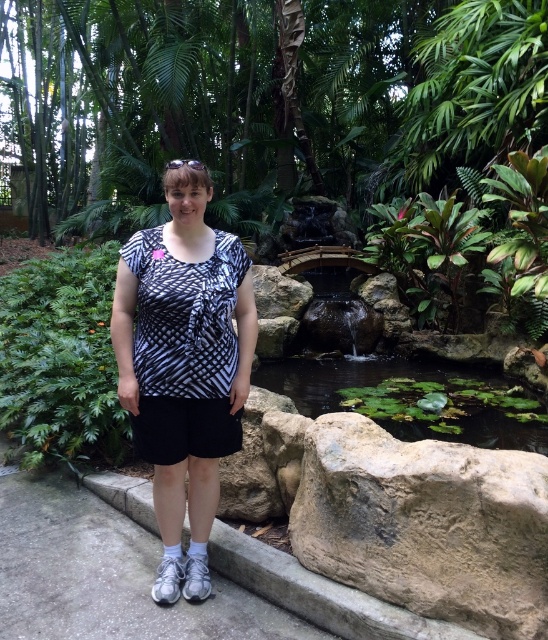
You are a photographer trying to capture a closeup of the printed cotton shirt at center and the green leafy pond at center in the image. Which object would require you to zoom out more to include both in the frame?

The green leafy pond at center occupies more space than the printed cotton shirt at center, so you would need to zoom out more to include both the printed cotton shirt at center and the green leafy pond at center in the frame.

You are a drone operator trying to capture a photo of the person in the tropical garden. The camera is currently focused on the brown rough rock at lower right. To center the person in the frame, should you adjust the camera to the left or right?

The brown rough rock at lower right is located at point 0.820 on the x axis, which is closer to the right edge of the frame. Since the person is positioned off to the left side of the frame, you should adjust the camera to the left to center them.